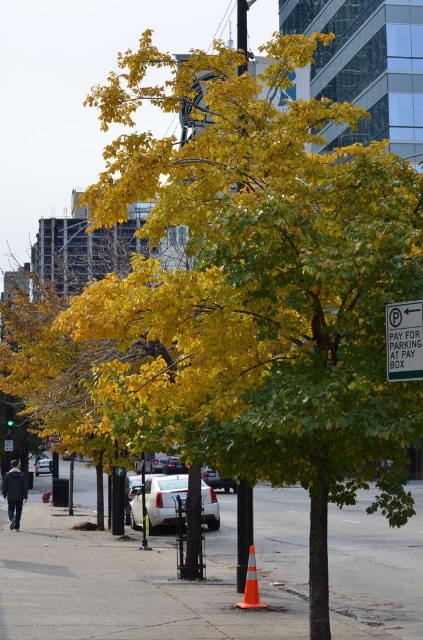
Question: Among these objects, which one is farthest from the camera?

Choices:
 (A) gray concrete sidewalk at center
 (B) white glossy car at center
 (C) white plastic sign at upper center

Answer: (C)

Question: Can you confirm if gray concrete sidewalk at center is smaller than orange reflective traffic cone at center?

Choices:
 (A) yes
 (B) no

Answer: (B)

Question: Is dark gray jacket at lower left bigger than shiny silver sedan at center?

Choices:
 (A) no
 (B) yes

Answer: (B)

Question: Which object is the closest to the white glossy car at center?

Choices:
 (A) gray concrete sidewalk at center
 (B) dark gray jacket at lower left
 (C) shiny silver sedan at center

Answer: (A)

Question: Is white glossy car at center to the left of white glossy sedan at center from the viewer's perspective?

Choices:
 (A) no
 (B) yes

Answer: (A)

Question: Among these objects, which one is farthest from the camera?

Choices:
 (A) white plastic street sign at right
 (B) white glossy sedan at center
 (C) gray concrete sidewalk at center
 (D) white plastic sign at upper center

Answer: (B)